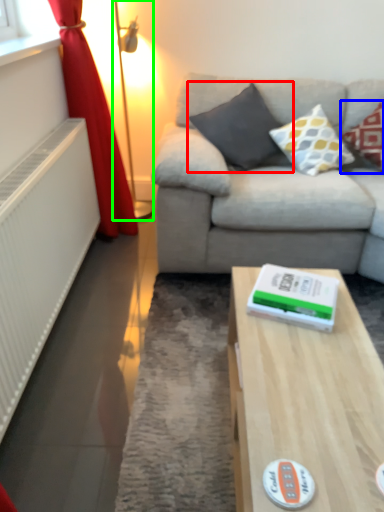
Question: Based on their relative distances, which object is nearer to pillow (highlighted by a red box)? Choose from pillow (highlighted by a blue box) and table lamp (highlighted by a green box).

Choices:
 (A) pillow
 (B) table lamp

Answer: (A)